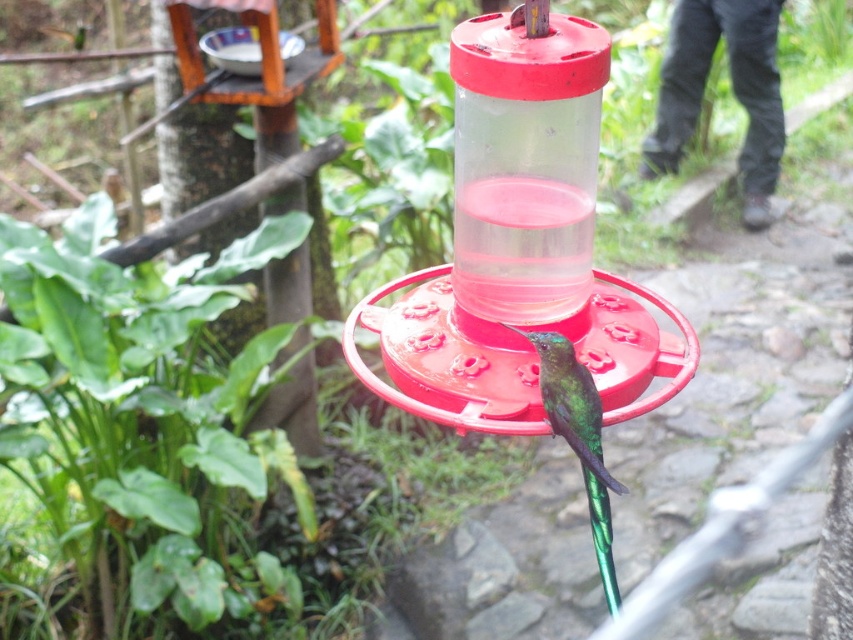
You are a birdwatcher trying to photograph the green iridescent bird at center. You need to know if the transparent plastic bird feeder at center is big enough to block the background wooden structure when taking a photo. Can you determine this based on their sizes?

The transparent plastic bird feeder at center is larger than the green iridescent bird at center. Since the feeder is bigger, it can potentially block the background wooden structure when positioned between the camera and the background, depending on their exact positions.

You are a birder observing the scene. You notice the transparent plastic bird feeder at center and the green iridescent bird at center. Which object is located to the right of the other?

The green iridescent bird at center is located to the right of the transparent plastic bird feeder at center because the feeder is positioned on the left side of the bird.